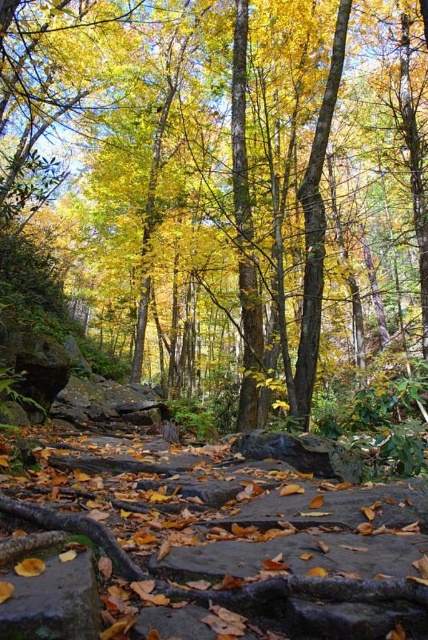
You are standing on the smooth gray rock at lower left and want to pick up the yellow leaves at center. Can you reach them without moving your feet?

The yellow leaves at center is positioned over smooth gray rock at lower left, so you can reach them without moving your feet since they are directly above your current position.